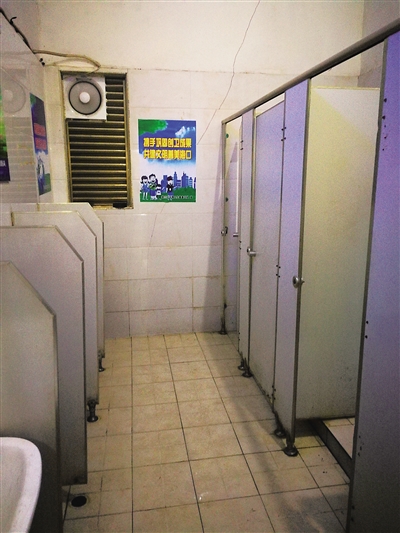
Where is `mirror`? Image resolution: width=400 pixels, height=533 pixels. mirror is located at coordinates (17, 150).